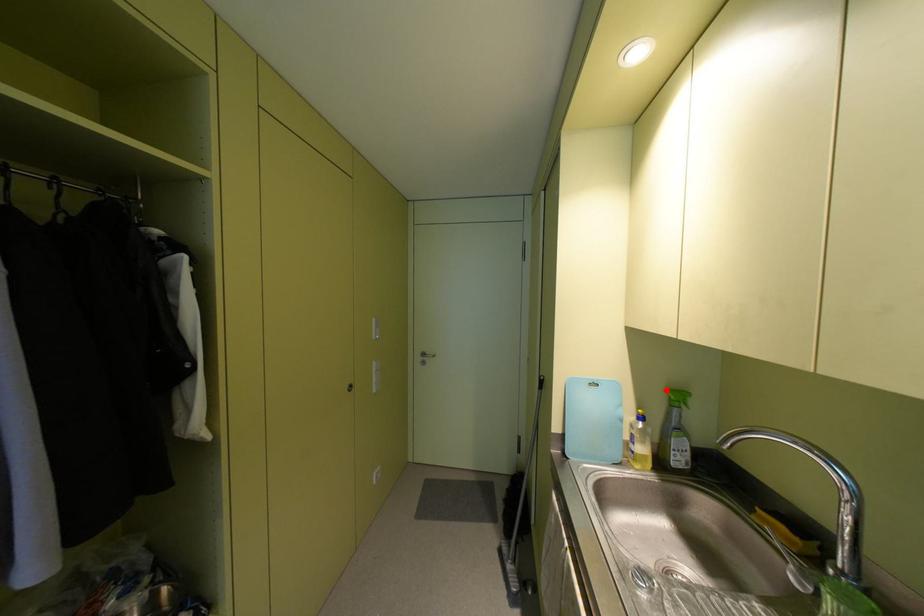
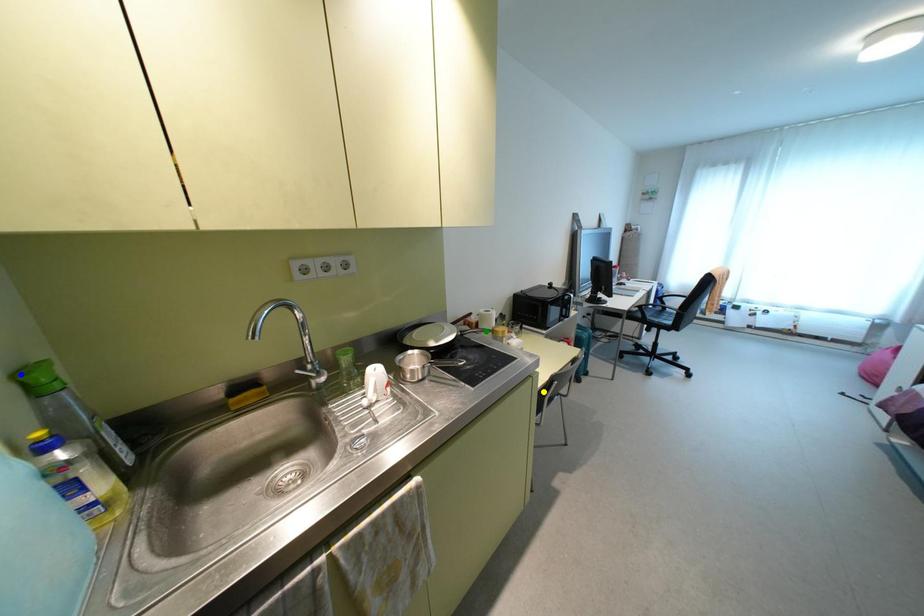
Question: I am providing you with two images of the same scene from different viewpoints. A red point is marked on the first image. You are given multiple points on the second image. Which mark in image 2 goes with the point in image 1?

Choices:
 (A) blue point
 (B) green point
 (C) yellow point

Answer: (A)